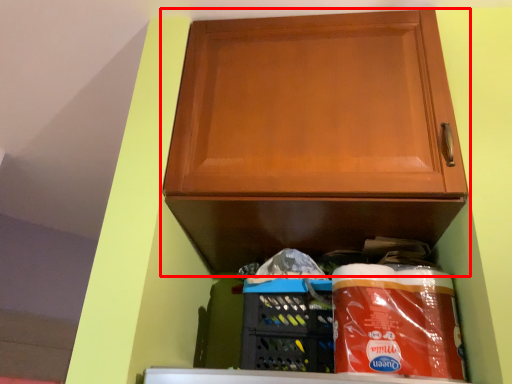
Question: From the image, what is the correct spatial relationship of cabinetry (annotated by the red box) in relation to basket?

Choices:
 (A) right
 (B) left

Answer: (A)